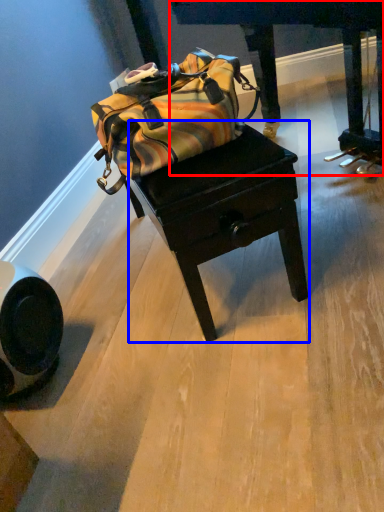
Question: Which object appears farthest to the camera in this image, furniture (highlighted by a red box) or table (highlighted by a blue box)?

Choices:
 (A) furniture
 (B) table

Answer: (B)